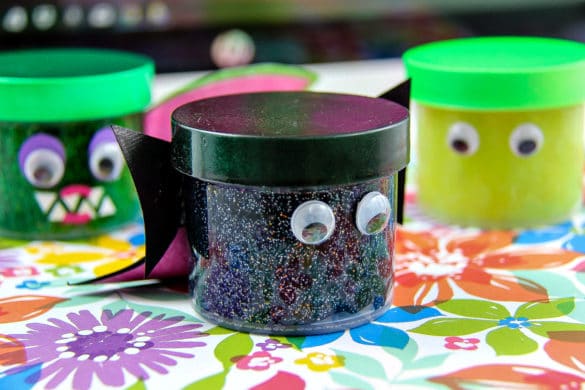
The width and height of the screenshot is (585, 390). Identify the location of cloth. (235, 84).